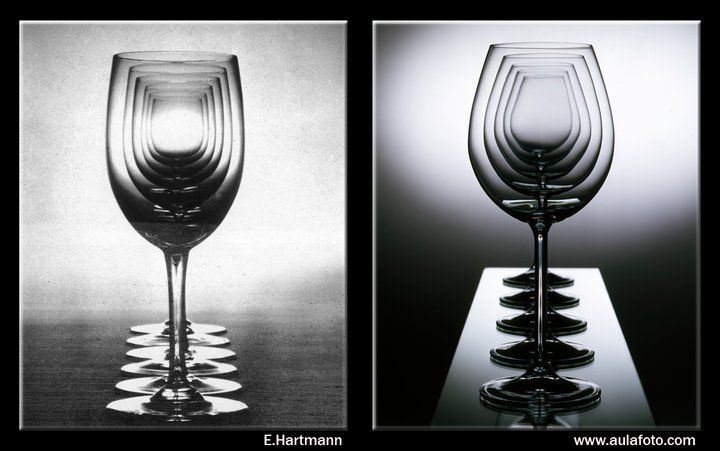
You are a GUI agent. You are given a task and a screenshot of the screen. Output one action in this format:
    pyautogui.click(x=<x>, y=<y>)
    Task: Click on the wine glasses on the right
    Image resolution: width=720 pixels, height=451 pixels.
    Given the screenshot: What is the action you would take?
    pyautogui.click(x=505, y=394), pyautogui.click(x=508, y=356), pyautogui.click(x=510, y=325), pyautogui.click(x=517, y=299), pyautogui.click(x=520, y=283)